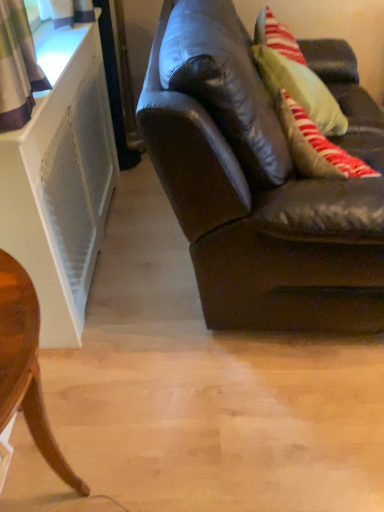
Question: Does brown leather couch at right have a lesser height compared to wooden round table at lower left?

Choices:
 (A) no
 (B) yes

Answer: (A)

Question: From a real-world perspective, is brown leather couch at right positioned under wooden round table at lower left based on gravity?

Choices:
 (A) yes
 (B) no

Answer: (B)

Question: Is brown leather couch at right wider than wooden round table at lower left?

Choices:
 (A) yes
 (B) no

Answer: (A)

Question: Does brown leather couch at right appear on the right side of wooden round table at lower left?

Choices:
 (A) no
 (B) yes

Answer: (B)

Question: Does brown leather couch at right have a greater height compared to wooden round table at lower left?

Choices:
 (A) no
 (B) yes

Answer: (B)

Question: Does brown leather couch at right have a larger size compared to wooden round table at lower left?

Choices:
 (A) no
 (B) yes

Answer: (B)

Question: Is wooden round table at lower left positioned with its back to brown leather couch at right?

Choices:
 (A) no
 (B) yes

Answer: (A)

Question: Considering the relative sizes of wooden round table at lower left and brown leather couch at right in the image provided, is wooden round table at lower left smaller than brown leather couch at right?

Choices:
 (A) no
 (B) yes

Answer: (B)

Question: Is wooden round table at lower left positioned in front of brown leather couch at right?

Choices:
 (A) yes
 (B) no

Answer: (A)

Question: Would you say wooden round table at lower left is a long distance from brown leather couch at right?

Choices:
 (A) yes
 (B) no

Answer: (B)

Question: Does wooden round table at lower left have a greater height compared to brown leather couch at right?

Choices:
 (A) no
 (B) yes

Answer: (A)

Question: From the image's perspective, is wooden round table at lower left under brown leather couch at right?

Choices:
 (A) yes
 (B) no

Answer: (A)

Question: Is wooden round table at lower left bigger or smaller than brown leather couch at right?

Choices:
 (A) small
 (B) big

Answer: (A)